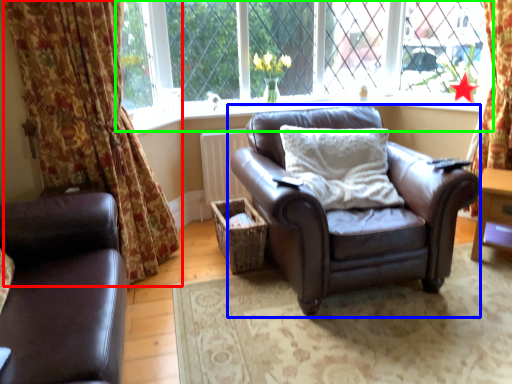
Question: Which is nearer to the curtain (highlighted by a red box)? chair (highlighted by a blue box) or window (highlighted by a green box).

Choices:
 (A) chair
 (B) window

Answer: (A)